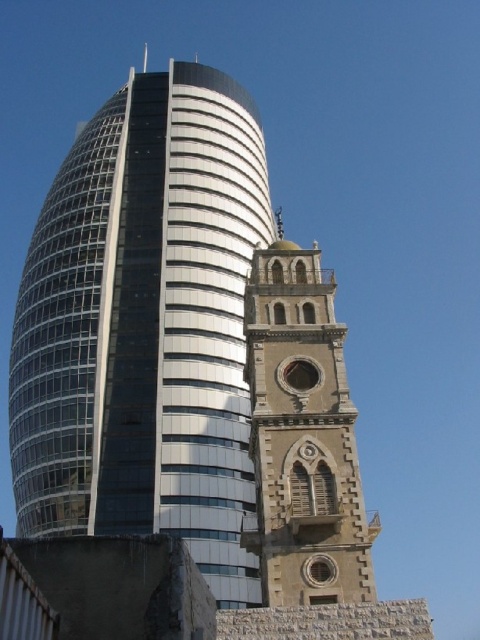
Question: Among these objects, which one is nearest to the camera?

Choices:
 (A) stone gothic bell tower at center
 (B) stone textured bell tower at center

Answer: (A)

Question: Considering the relative positions of stone textured bell tower at center and stone gothic bell tower at center in the image provided, where is stone textured bell tower at center located with respect to stone gothic bell tower at center?

Choices:
 (A) below
 (B) above

Answer: (B)

Question: Is stone textured bell tower at center behind stone gothic bell tower at center?

Choices:
 (A) yes
 (B) no

Answer: (A)

Question: Is the position of stone textured bell tower at center less distant than that of stone gothic bell tower at center?

Choices:
 (A) yes
 (B) no

Answer: (B)